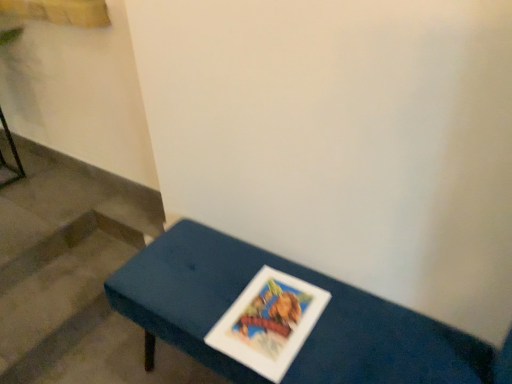
The width and height of the screenshot is (512, 384). What are the coordinates of `vacant space underneath metallic black stool at left (from a real-world perspective)` in the screenshot? It's located at (10, 175).